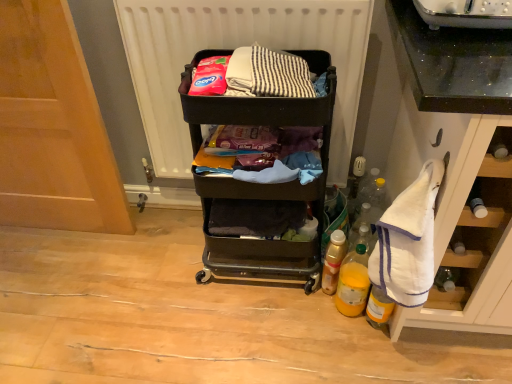
Where is `free space on the front side of yellow matte bottle at lower right, arranged as the second bottle when viewed from the right`? free space on the front side of yellow matte bottle at lower right, arranged as the second bottle when viewed from the right is located at coordinates (358, 354).